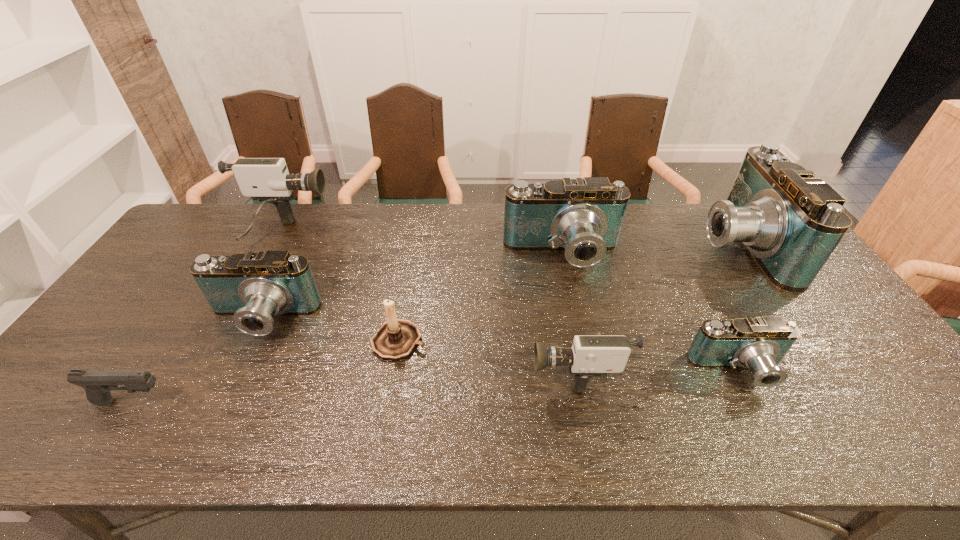
You are a GUI agent. You are given a task and a screenshot of the screen. Output one action in this format:
    pyautogui.click(x=<x>, y=<y>)
    Task: Click on the nearest blue camcorder
    The height and width of the screenshot is (540, 960).
    Given the screenshot: What is the action you would take?
    pyautogui.click(x=759, y=344)

This screenshot has width=960, height=540. Identify the location of the shortest camcorder. (759, 344).

Locate an element on the screen. pistol is located at coordinates [x=97, y=384].

You are a GUI agent. You are given a task and a screenshot of the screen. Output one action in this format:
    pyautogui.click(x=<x>, y=<y>)
    Task: Click on the vacant point located on the front-facing side of the biggest blue camcorder
    Image resolution: width=960 pixels, height=540 pixels.
    Given the screenshot: What is the action you would take?
    pyautogui.click(x=574, y=244)

Identify the location of free location located 0.190m on the front-facing side of the biggest blue camcorder. point(638,244).

Identify the location of vacant area situated on the front-facing side of the biggest blue camcorder. (636, 244).

The height and width of the screenshot is (540, 960). What are the coordinates of `free space located on the recording direction of the bigger white camcorder` in the screenshot? It's located at (416, 234).

Locate an element on the screen. The image size is (960, 540). vacant space situated 0.130m on the front-facing side of the third blue camcorder from right to left is located at coordinates (574, 310).

At what (x,y) coordinates should I click in order to perform the action: click on free region located on the front-facing side of the leftmost blue camcorder. Please return your answer as a coordinate pair (x, y). Image resolution: width=960 pixels, height=540 pixels. Looking at the image, I should click on (221, 404).

You are a GUI agent. You are given a task and a screenshot of the screen. Output one action in this format:
    pyautogui.click(x=<x>, y=<y>)
    Task: Click on the free space located 0.210m on the recording direction of the smaller white camcorder
    The height and width of the screenshot is (540, 960).
    Given the screenshot: What is the action you would take?
    pos(444,369)